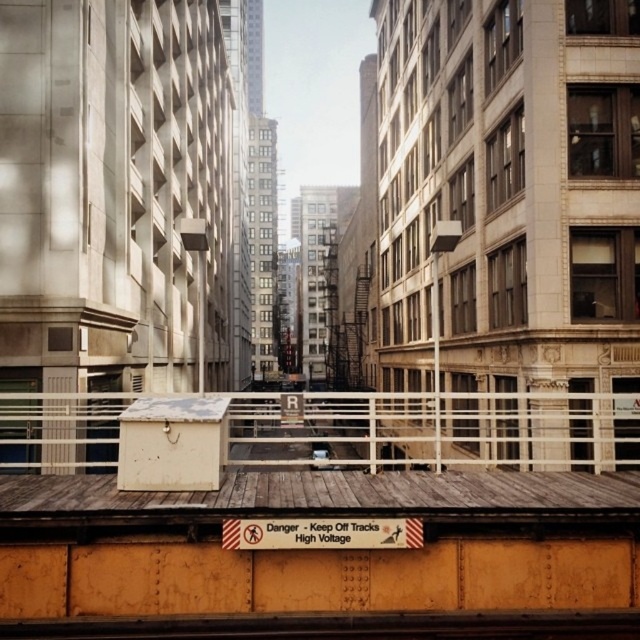
Question: Which of the following is the closest to the observer?

Choices:
 (A) white metal rail at center
 (B) smooth steel train track at bottom center

Answer: (B)

Question: Among these points, which one is nearest to the camera?

Choices:
 (A) (241, 618)
 (B) (369, 396)

Answer: (A)

Question: Does white metal rail at center appear on the right side of smooth steel train track at bottom center?

Choices:
 (A) yes
 (B) no

Answer: (B)

Question: Which point is closer to the camera?

Choices:
 (A) white metal rail at center
 (B) smooth steel train track at bottom center

Answer: (B)

Question: Can you confirm if white metal rail at center is positioned below smooth steel train track at bottom center?

Choices:
 (A) no
 (B) yes

Answer: (B)

Question: Is white metal rail at center to the left of smooth steel train track at bottom center from the viewer's perspective?

Choices:
 (A) no
 (B) yes

Answer: (B)